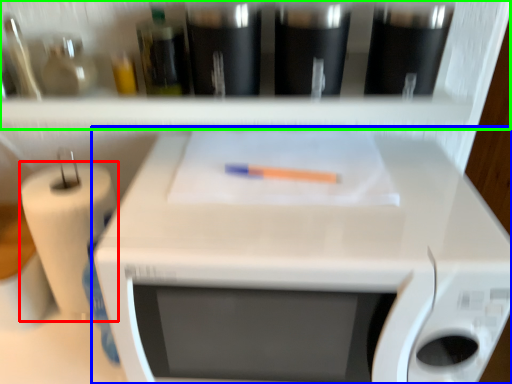
Question: Estimate the real-world distances between objects in this image. Which object is farther from paper towel (highlighted by a red box), appliance (highlighted by a blue box) or shelf (highlighted by a green box)?

Choices:
 (A) appliance
 (B) shelf

Answer: (B)